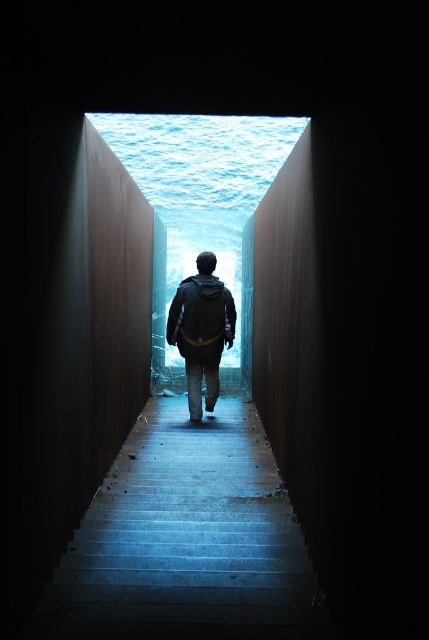
Which is in front, point (157, 580) or point (214, 298)?

Point (157, 580) is more forward.

Does concrete stairs at center have a greater height compared to dark gray jacket at center?

In fact, concrete stairs at center may be shorter than dark gray jacket at center.

Is point (196, 500) positioned after point (190, 340)?

That is False.

At what (x,y) coordinates should I click in order to perform the action: click on concrete stairs at center. Please return your answer as a coordinate pair (x, y). The width and height of the screenshot is (429, 640). Looking at the image, I should click on (187, 540).

Is concrete stairs at center below blue glass water at center?

Correct, concrete stairs at center is located below blue glass water at center.

Which is in front, point (304, 609) or point (150, 166)?

Point (304, 609) is in front.

Locate an element on the screen. The height and width of the screenshot is (640, 429). concrete stairs at center is located at coordinates (187, 540).

Does point (250, 280) come closer to viewer compared to point (196, 333)?

No, it is not.

This screenshot has width=429, height=640. What do you see at coordinates (199, 209) in the screenshot?
I see `blue glass water at center` at bounding box center [199, 209].

At what (x,y) coordinates should I click in order to perform the action: click on blue glass water at center. Please return your answer as a coordinate pair (x, y). This screenshot has height=640, width=429. Looking at the image, I should click on coord(199,209).